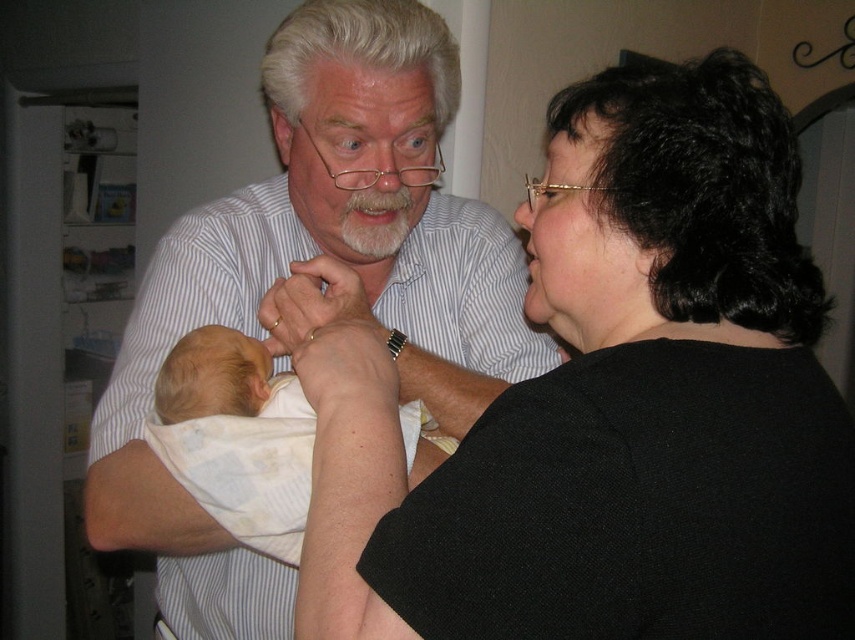
Question: Which of the following is the closest to the observer?

Choices:
 (A) black fabric shirt at upper right
 (B) white striped shirt at upper left
 (C) soft white swaddle at center
 (D) white hair at upper center

Answer: (A)

Question: Can you confirm if black fabric shirt at upper right is positioned above white striped shirt at upper left?

Choices:
 (A) yes
 (B) no

Answer: (A)

Question: Which point is closer to the camera?

Choices:
 (A) white hair at upper center
 (B) black fabric shirt at upper right
 (C) soft white swaddle at center
 (D) white striped shirt at upper left

Answer: (B)

Question: Is soft white swaddle at center to the right of white hair at upper center from the viewer's perspective?

Choices:
 (A) no
 (B) yes

Answer: (A)

Question: Which object is positioned farthest from the white hair at upper center?

Choices:
 (A) white striped shirt at upper left
 (B) soft white swaddle at center

Answer: (B)

Question: Is white striped shirt at upper left positioned before white hair at upper center?

Choices:
 (A) yes
 (B) no

Answer: (A)